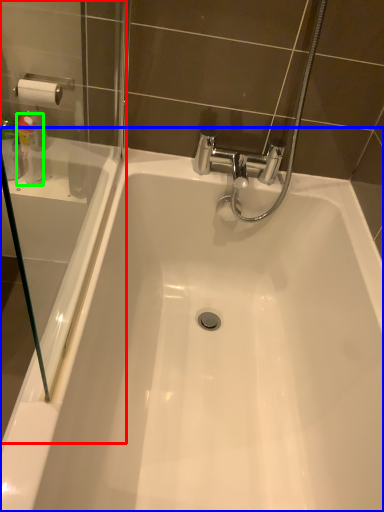
Question: Based on their relative distances, which object is nearer to screen door (highlighted by a red box)? Choose from bathtub (highlighted by a blue box) and cleaning product (highlighted by a green box).

Choices:
 (A) bathtub
 (B) cleaning product

Answer: (B)